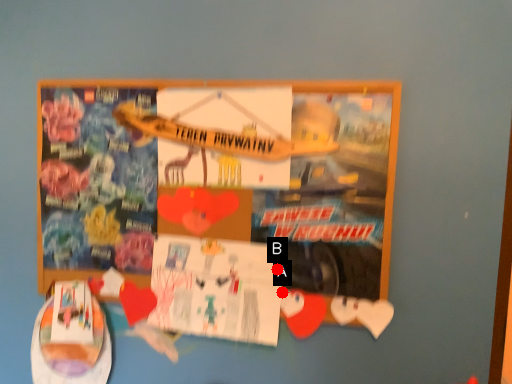
Question: Two points are circled on the image, labeled by A and B beside each circle. Which of the following is the farthest from the observer?

Choices:
 (A) A is further
 (B) B is further

Answer: (B)